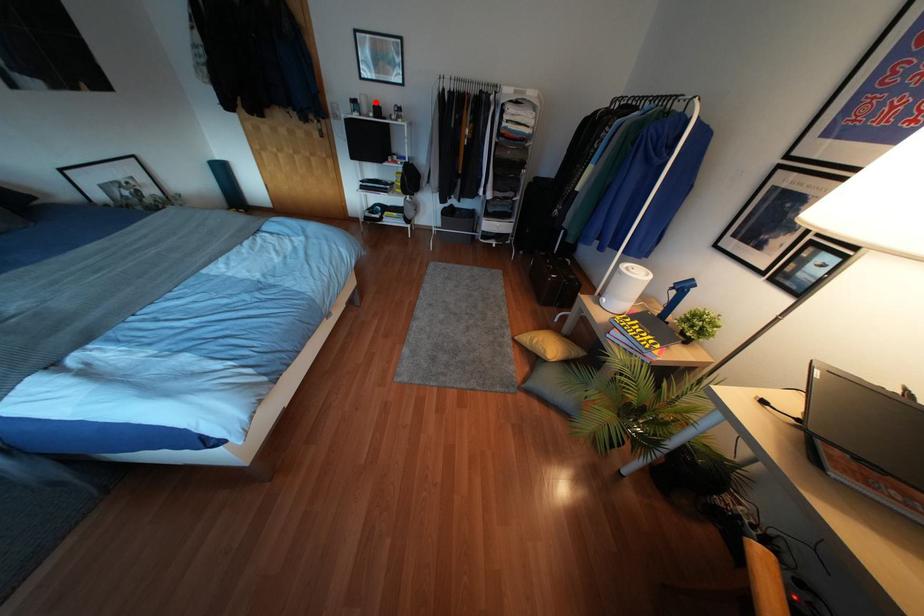
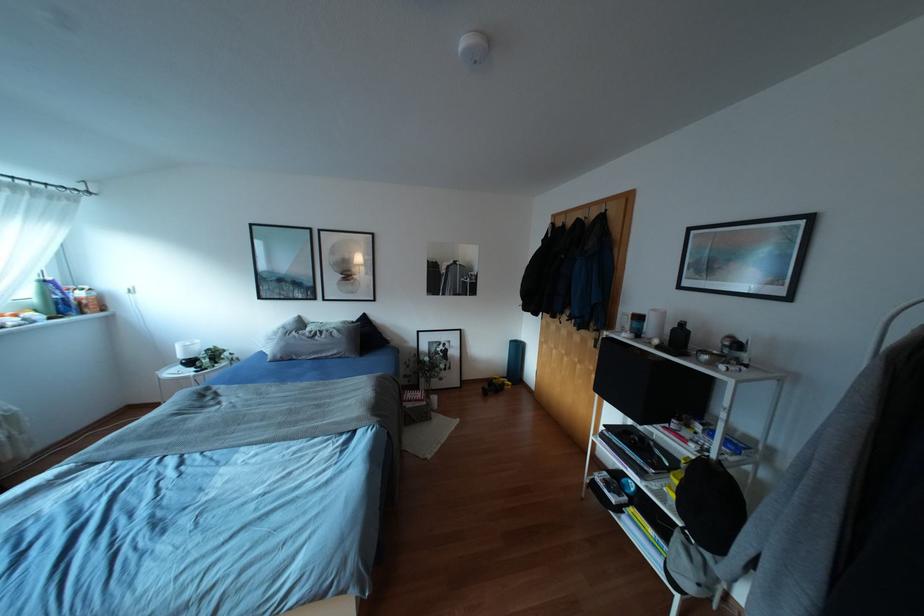
Locate, in the second image, the point that corresponds to the highlighted location in the first image.

(682, 323)